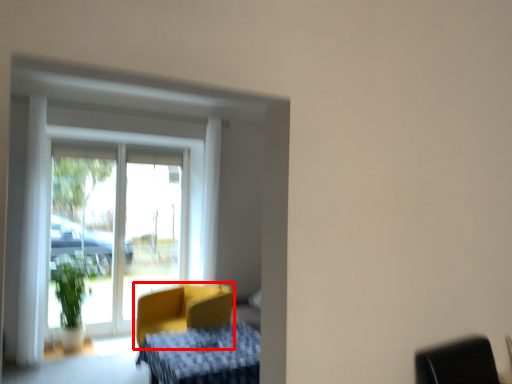
Question: Considering the relative positions of chair (annotated by the red box) and furniture in the image provided, where is chair (annotated by the red box) located with respect to the staircase?

Choices:
 (A) right
 (B) left

Answer: (B)